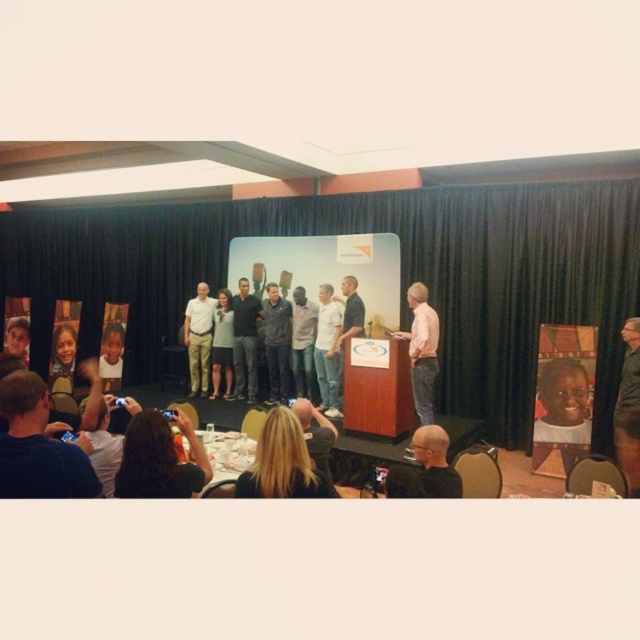
Where is `pink shirt at center`? The height and width of the screenshot is (640, 640). pink shirt at center is located at coordinates (420, 349).

Does pink shirt at center have a lesser width compared to dark gray jeans at center?

No.

At what (x,y) coordinates should I click in order to perform the action: click on pink shirt at center. Please return your answer as a coordinate pair (x, y). Looking at the image, I should click on (420, 349).

Measure the distance between point (317, 324) and camera.

Point (317, 324) and camera are 22.89 feet apart.

Locate an element on the screen. The image size is (640, 640). white shirt at center is located at coordinates (326, 352).

Can you confirm if dark gray jeans at center is shorter than light beige pants at center?

In fact, dark gray jeans at center may be taller than light beige pants at center.

The height and width of the screenshot is (640, 640). What are the coordinates of `dark gray jeans at center` in the screenshot? It's located at (244, 340).

Locate an element on the screen. dark gray jeans at center is located at coordinates (244, 340).